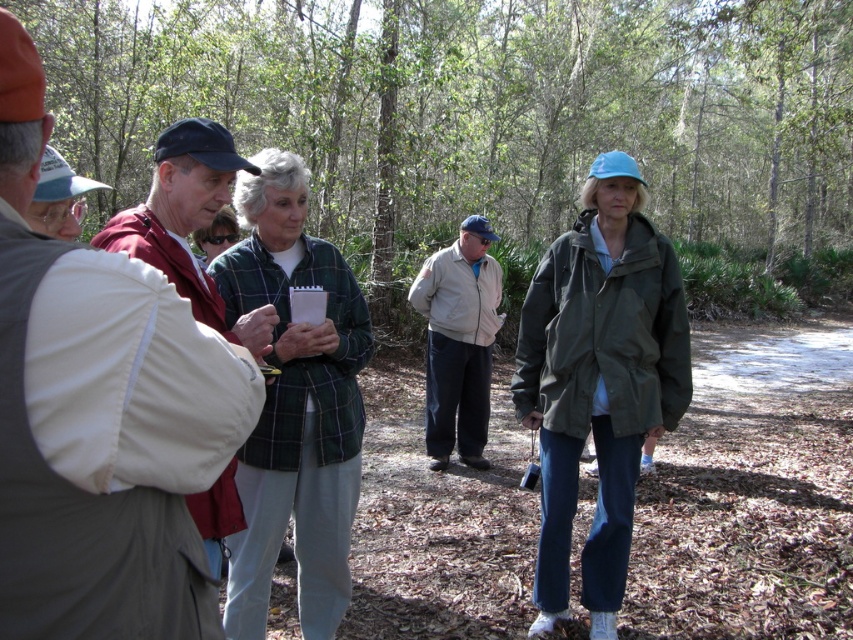
Question: Based on their relative distances, which object is nearer to the green plaid shirt at center?

Choices:
 (A) green leafy tree at center
 (B) light beige jacket at center

Answer: (B)

Question: Does green leafy tree at center appear on the right side of olive-green fabric jacket at center-right?

Choices:
 (A) no
 (B) yes

Answer: (B)

Question: Is the position of green leafy tree at center less distant than that of light beige jacket at center?

Choices:
 (A) no
 (B) yes

Answer: (A)

Question: Which point is farther to the camera?

Choices:
 (A) (619, 420)
 (B) (460, 426)
 (C) (625, 108)

Answer: (C)

Question: Is green leafy tree at center wider than light beige jacket at center?

Choices:
 (A) no
 (B) yes

Answer: (B)

Question: Which of the following is the farthest from the observer?

Choices:
 (A) green plaid shirt at center
 (B) light beige jacket at center
 (C) green leafy tree at center

Answer: (C)